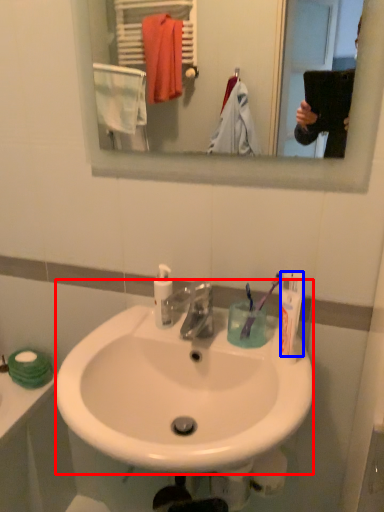
Question: Which of the following is the closest to the observer, sink (highlighted by a red box) or toothpaste (highlighted by a blue box)?

Choices:
 (A) sink
 (B) toothpaste

Answer: (A)